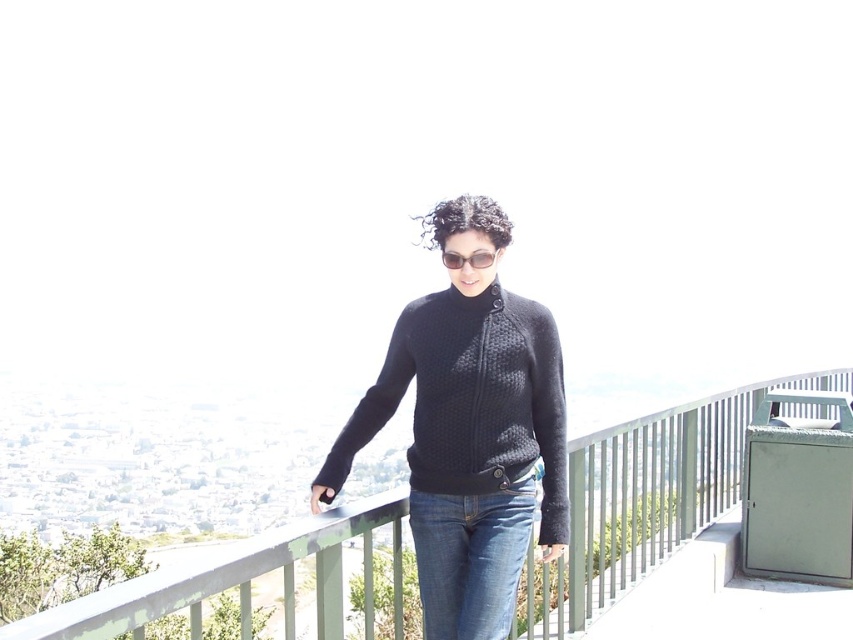
Question: Does denim jeans at center come in front of black plastic sunglasses at center?

Choices:
 (A) no
 (B) yes

Answer: (B)

Question: Which object is positioned closest to the denim jeans at center?

Choices:
 (A) matte black sweater at center
 (B) green metal railing at center
 (C) black plastic sunglasses at center

Answer: (A)

Question: Does matte black sweater at center appear under green metal railing at center?

Choices:
 (A) yes
 (B) no

Answer: (B)

Question: Considering the real-world distances, which object is farthest from the matte black sweater at center?

Choices:
 (A) denim jeans at center
 (B) black plastic sunglasses at center
 (C) green metal railing at center

Answer: (B)

Question: Is green metal railing at center wider than denim jeans at center?

Choices:
 (A) no
 (B) yes

Answer: (B)

Question: Estimate the real-world distances between objects in this image. Which object is closer to the matte black sweater at center?

Choices:
 (A) black plastic sunglasses at center
 (B) denim jeans at center
 (C) green metal railing at center

Answer: (B)